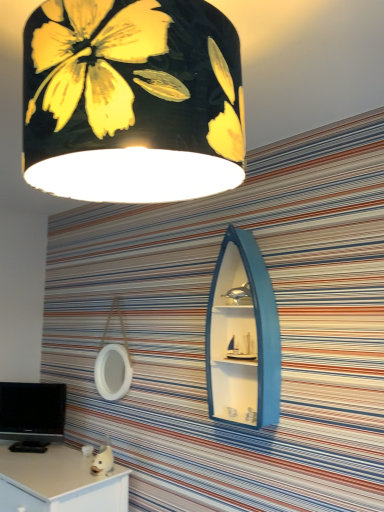
Question: From the image's perspective, would you say black glossy computer monitor at lower left is shown under blue matte boat-shaped cabinet at center?

Choices:
 (A) no
 (B) yes

Answer: (B)

Question: Is black glossy computer monitor at lower left facing towards blue matte boat-shaped cabinet at center?

Choices:
 (A) no
 (B) yes

Answer: (A)

Question: Is black glossy computer monitor at lower left at the left side of blue matte boat-shaped cabinet at center?

Choices:
 (A) yes
 (B) no

Answer: (A)

Question: Is black glossy computer monitor at lower left wider than blue matte boat-shaped cabinet at center?

Choices:
 (A) no
 (B) yes

Answer: (A)

Question: From the image's perspective, is black glossy computer monitor at lower left on blue matte boat-shaped cabinet at center?

Choices:
 (A) yes
 (B) no

Answer: (B)

Question: Can you confirm if black glossy computer monitor at lower left is taller than blue matte boat-shaped cabinet at center?

Choices:
 (A) yes
 (B) no

Answer: (B)

Question: Is blue matte boat-shaped cabinet at center turned away from white matte desk at lower left?

Choices:
 (A) yes
 (B) no

Answer: (B)

Question: Is blue matte boat-shaped cabinet at center located outside white matte desk at lower left?

Choices:
 (A) yes
 (B) no

Answer: (A)

Question: From the image's perspective, is blue matte boat-shaped cabinet at center on top of white matte desk at lower left?

Choices:
 (A) yes
 (B) no

Answer: (A)

Question: Is blue matte boat-shaped cabinet at center next to white matte desk at lower left and touching it?

Choices:
 (A) yes
 (B) no

Answer: (B)

Question: Does blue matte boat-shaped cabinet at center lie behind white matte desk at lower left?

Choices:
 (A) yes
 (B) no

Answer: (B)

Question: Can you confirm if blue matte boat-shaped cabinet at center is positioned to the left of white matte desk at lower left?

Choices:
 (A) no
 (B) yes

Answer: (A)

Question: From a real-world perspective, is white matte desk at lower left located higher than black glossy computer monitor at lower left?

Choices:
 (A) yes
 (B) no

Answer: (B)